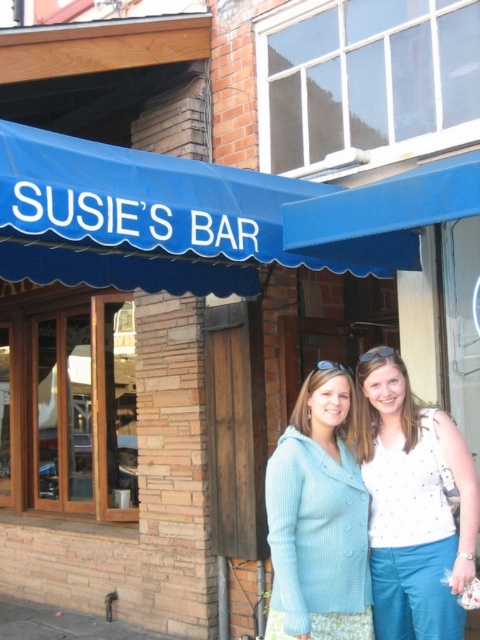
Which is more to the left, blue fabric awning at upper center or white dotted blouse at center?

blue fabric awning at upper center is more to the left.

Between point (180, 257) and point (394, 632), which one is positioned behind?

The point (180, 257) is behind.

What do you see at coordinates (157, 220) in the screenshot?
I see `blue fabric awning at upper center` at bounding box center [157, 220].

The height and width of the screenshot is (640, 480). In order to click on blue fabric awning at upper center in this screenshot , I will do `click(157, 220)`.

Between point (44, 205) and point (326, 531), which one is positioned behind?

The point (326, 531) is behind.

Which is in front, point (184, 284) or point (350, 628)?

Point (350, 628) is more forward.

Identify the location of blue fabric awning at upper center. (157, 220).

Can you confirm if white dotted blouse at center is shorter than light blue knit sweater at center?

Incorrect, white dotted blouse at center's height does not fall short of light blue knit sweater at center's.

Between white dotted blouse at center and light blue knit sweater at center, which one appears on the right side from the viewer's perspective?

From the viewer's perspective, white dotted blouse at center appears more on the right side.

Measure the distance between white dotted blouse at center and camera.

The distance of white dotted blouse at center from camera is 3.30 meters.

The height and width of the screenshot is (640, 480). In order to click on white dotted blouse at center in this screenshot , I will do `click(412, 504)`.